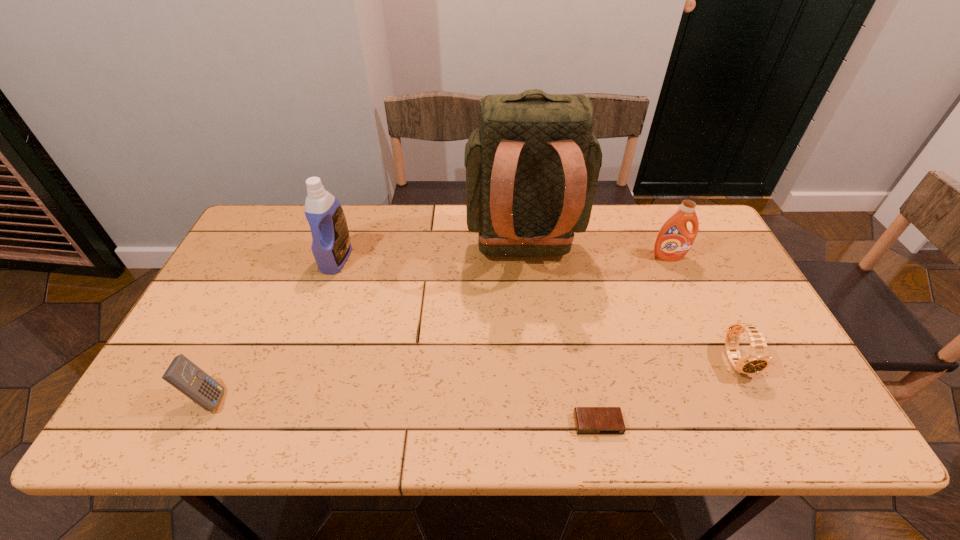
At what (x,y) coordinates should I click in order to perform the action: click on the tallest object. Please return your answer as a coordinate pair (x, y). The image size is (960, 540). Looking at the image, I should click on [x=532, y=169].

Identify the location of the taller detergent. (331, 247).

The height and width of the screenshot is (540, 960). I want to click on the left detergent, so pos(331,247).

The width and height of the screenshot is (960, 540). In order to click on the fourth shortest object in this screenshot , I will do `click(674, 240)`.

This screenshot has width=960, height=540. Find the location of `the right detergent`. the right detergent is located at coordinates (674, 240).

At what (x,y) coordinates should I click in order to perform the action: click on the leftmost object. Please return your answer as a coordinate pair (x, y). This screenshot has width=960, height=540. Looking at the image, I should click on (183, 374).

You are a GUI agent. You are given a task and a screenshot of the screen. Output one action in this format:
    pyautogui.click(x=<x>, y=<y>)
    Task: Click on the watch
    The image size is (960, 540).
    Given the screenshot: What is the action you would take?
    coord(757,359)

The image size is (960, 540). In order to click on the fourth farthest object in this screenshot , I will do click(757, 359).

This screenshot has width=960, height=540. Find the location of `alarm clock`. alarm clock is located at coordinates (588, 420).

Where is `vacant region located on the back of the tallest object`? vacant region located on the back of the tallest object is located at coordinates (538, 387).